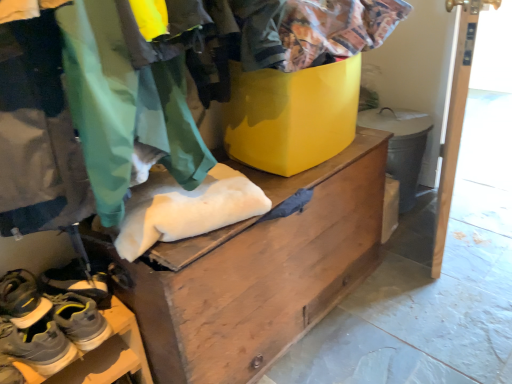
Question: Is wooden chest at center bigger than gray suede sneakers at lower left, the 3th footwear positioned from the bottom?

Choices:
 (A) no
 (B) yes

Answer: (B)

Question: Does wooden chest at center have a lesser width compared to gray suede sneakers at lower left, the 3th footwear positioned from the bottom?

Choices:
 (A) no
 (B) yes

Answer: (A)

Question: From the image's perspective, is wooden chest at center under gray suede sneakers at lower left, the 3th footwear positioned from the bottom?

Choices:
 (A) no
 (B) yes

Answer: (A)

Question: Can you confirm if wooden chest at center is positioned to the right of gray suede sneakers at lower left, the 1th footwear viewed from the top?

Choices:
 (A) yes
 (B) no

Answer: (A)

Question: From a real-world perspective, is wooden chest at center physically above gray suede sneakers at lower left, the 1th footwear viewed from the top?

Choices:
 (A) yes
 (B) no

Answer: (B)

Question: Can you confirm if wooden chest at center is smaller than gray suede sneakers at lower left, the 1th footwear viewed from the top?

Choices:
 (A) yes
 (B) no

Answer: (B)

Question: Is gray suede sneakers at lower left, which is counted as the 3th footwear, starting from the top, not within gray suede sneakers at lower left, positioned as the second footwear in bottom-to-top order?

Choices:
 (A) yes
 (B) no

Answer: (A)

Question: Considering the relative sizes of gray suede sneakers at lower left, which is counted as the 3th footwear, starting from the top, and gray suede sneakers at lower left, the 2th footwear when ordered from top to bottom, in the image provided, is gray suede sneakers at lower left, which is counted as the 3th footwear, starting from the top, bigger than gray suede sneakers at lower left, the 2th footwear when ordered from top to bottom,?

Choices:
 (A) yes
 (B) no

Answer: (A)

Question: Is gray suede sneakers at lower left, which is the 1th footwear in bottom-to-top order, behind gray suede sneakers at lower left, positioned as the second footwear in bottom-to-top order?

Choices:
 (A) no
 (B) yes

Answer: (A)

Question: Can you confirm if gray suede sneakers at lower left, which is the 1th footwear in bottom-to-top order, is positioned to the right of gray suede sneakers at lower left, the 2th footwear when ordered from top to bottom?

Choices:
 (A) no
 (B) yes

Answer: (B)

Question: Does gray suede sneakers at lower left, which is the 1th footwear in bottom-to-top order, have a greater height compared to gray suede sneakers at lower left, positioned as the second footwear in bottom-to-top order?

Choices:
 (A) yes
 (B) no

Answer: (A)

Question: Can you see gray suede sneakers at lower left, which is counted as the 3th footwear, starting from the top, touching gray suede sneakers at lower left, positioned as the second footwear in bottom-to-top order?

Choices:
 (A) yes
 (B) no

Answer: (A)

Question: Is gray suede sneakers at lower left, the 3th footwear positioned from the bottom, aimed at white wood door at right?

Choices:
 (A) yes
 (B) no

Answer: (B)